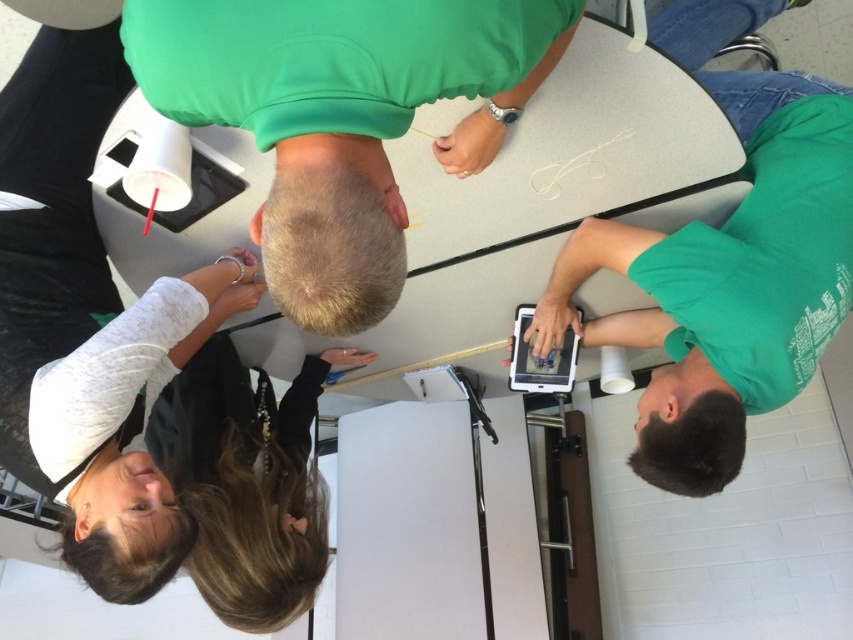
Question: Which point is farther to the camera?

Choices:
 (A) (370, 237)
 (B) (596, 259)
 (C) (97, 468)

Answer: (B)

Question: Considering the real-world distances, which object is closest to the dark brown hair at lower left?

Choices:
 (A) white matte cup at upper left
 (B) green fabric headrest at upper center

Answer: (A)

Question: Can you confirm if white matte cup at upper left is bigger than green matte shirt at lower right?

Choices:
 (A) yes
 (B) no

Answer: (A)

Question: Does green matte shirt at lower right lie behind dark brown hair at lower left?

Choices:
 (A) no
 (B) yes

Answer: (A)

Question: Considering the relative positions of green matte shirt at lower right and dark brown hair at lower left in the image provided, where is green matte shirt at lower right located with respect to dark brown hair at lower left?

Choices:
 (A) left
 (B) right

Answer: (B)

Question: Which object is the closest to the dark brown hair at lower left?

Choices:
 (A) green fabric headrest at upper center
 (B) white matte cup at upper left
 (C) green matte shirt at lower right

Answer: (B)